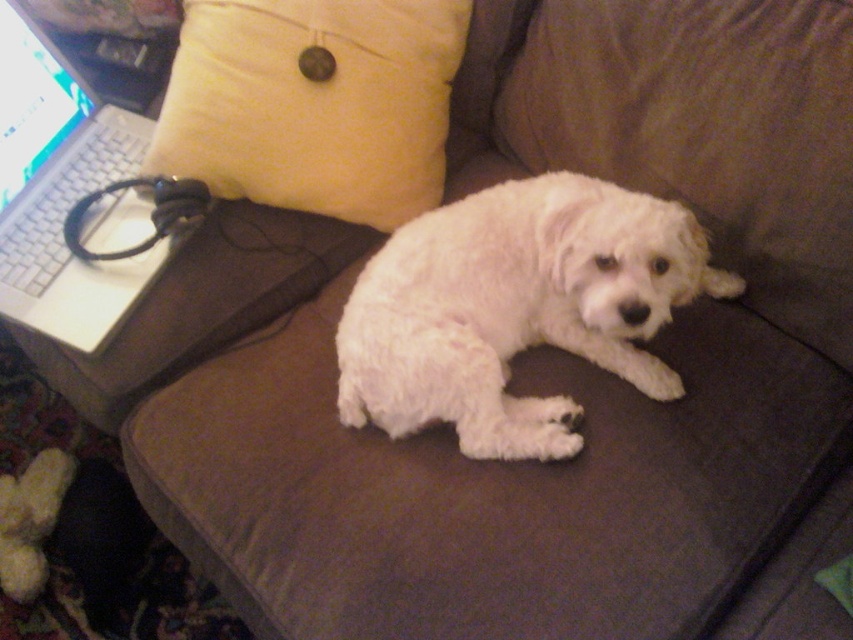
Question: Which object appears closest to the camera in this image?

Choices:
 (A) yellow soft pillow at upper left
 (B) white plastic laptop at left

Answer: (B)

Question: Does white fluffy dog at center have a lesser width compared to white plastic laptop at left?

Choices:
 (A) yes
 (B) no

Answer: (B)

Question: Which point is farther from the camera taking this photo?

Choices:
 (A) coord(4,74)
 (B) coord(534,248)

Answer: (A)

Question: Which point is farther to the camera?

Choices:
 (A) white plastic laptop at left
 (B) yellow soft pillow at upper left

Answer: (B)

Question: Considering the relative positions of white fluffy dog at center and white plastic laptop at left in the image provided, where is white fluffy dog at center located with respect to white plastic laptop at left?

Choices:
 (A) below
 (B) above

Answer: (A)

Question: Can you confirm if yellow soft pillow at upper left is wider than white plastic laptop at left?

Choices:
 (A) yes
 (B) no

Answer: (A)